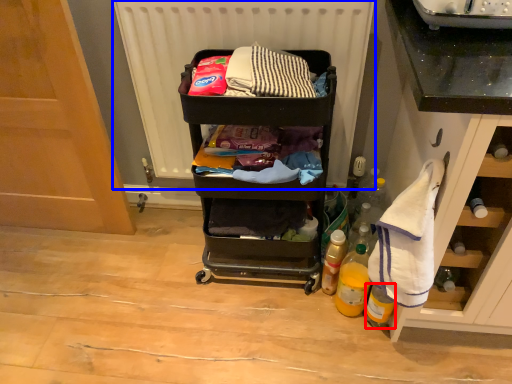
Question: Which point is further to the camera, bottle (highlighted by a red box) or radiator (highlighted by a blue box)?

Choices:
 (A) bottle
 (B) radiator

Answer: (A)